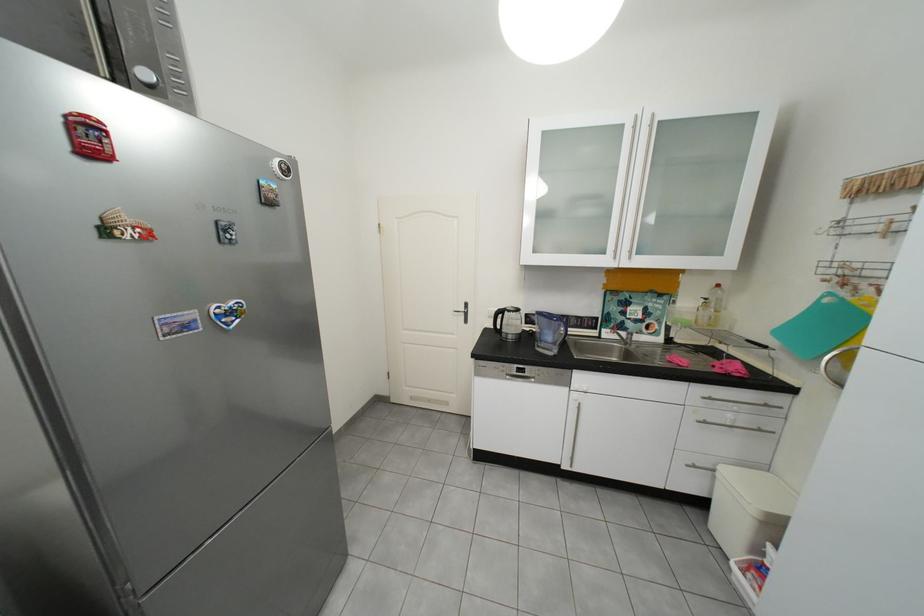
Locate an element on the screen. trash can lid is located at coordinates (758, 493).